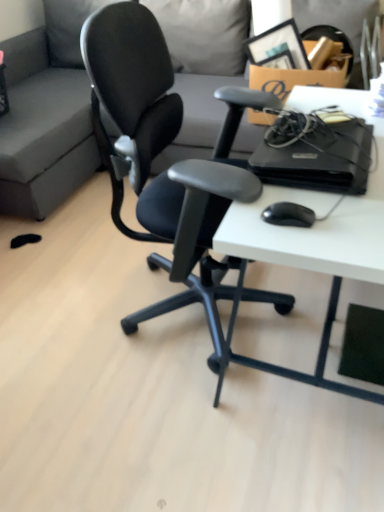
At what (x,y) coordinates should I click in order to perform the action: click on vacant area situated to the left side of white matte desk at center. Please return your answer as a coordinate pair (x, y). The width and height of the screenshot is (384, 512). Looking at the image, I should click on pos(129,377).